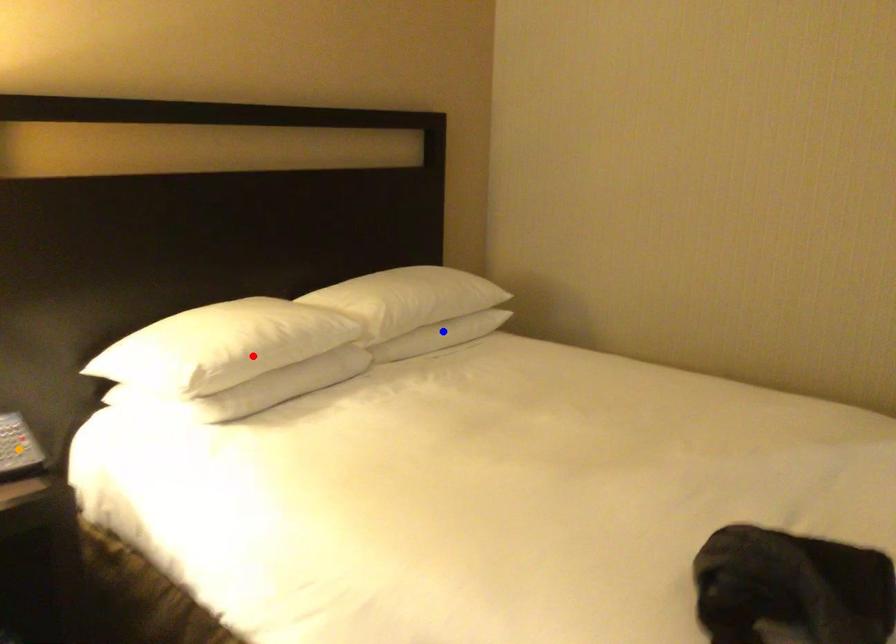
Order these from nearest to farthest:
- orange point
- blue point
- red point

orange point → red point → blue point